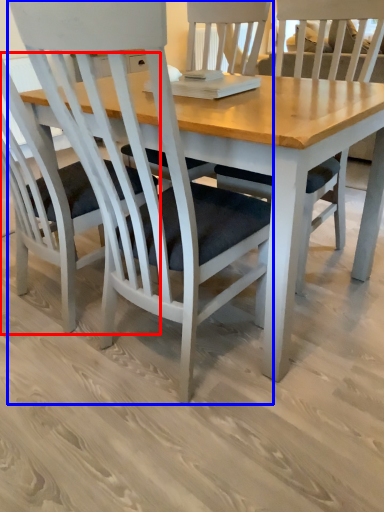
Question: Which point is further to the camera, chair (highlighted by a red box) or chair (highlighted by a blue box)?

Choices:
 (A) chair
 (B) chair

Answer: (A)